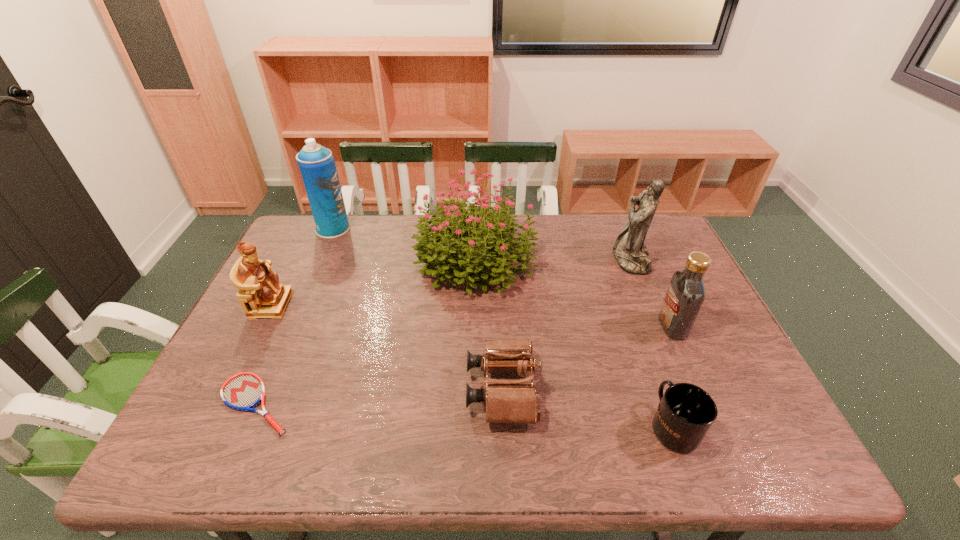
I want to click on vacant space at the far edge of the desktop, so click(398, 222).

This screenshot has height=540, width=960. Identify the location of vacant region at the near edge of the desktop. (555, 441).

Where is `vacant space at the left edge of the desktop`? This screenshot has width=960, height=540. vacant space at the left edge of the desktop is located at coordinates (275, 347).

Find the location of `blank area at the right edge`. blank area at the right edge is located at coordinates (724, 367).

Find the location of `vacant area between the shortest object and the taller figurine`. vacant area between the shortest object and the taller figurine is located at coordinates (444, 332).

Locate an element on the screen. The height and width of the screenshot is (540, 960). vacant region between the shortest object and the bouquet is located at coordinates (367, 332).

Identify the location of unoccupied area between the bouquet and the right figurine. The width and height of the screenshot is (960, 540). (554, 259).

Where is `unoccupied area between the binoculars and the aerosol can`? The width and height of the screenshot is (960, 540). unoccupied area between the binoculars and the aerosol can is located at coordinates 418,309.

Image resolution: width=960 pixels, height=540 pixels. I want to click on vacant space that is in between the bouquet and the farther figurine, so coord(554,259).

This screenshot has width=960, height=540. Find the location of `free point between the vodka and the farther figurine`. free point between the vodka and the farther figurine is located at coordinates (652, 293).